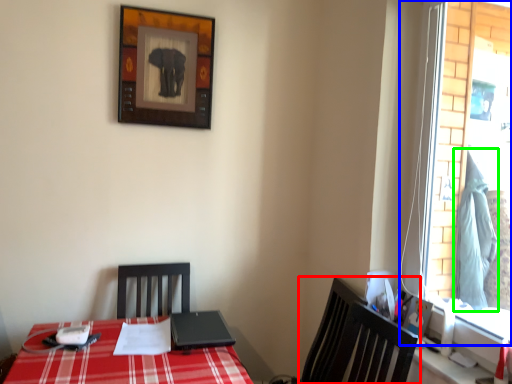
Question: Based on their relative distances, which object is nearer to chair (highlighted by a red box)? Choose from window (highlighted by a blue box) and curtain (highlighted by a green box).

Choices:
 (A) window
 (B) curtain

Answer: (B)